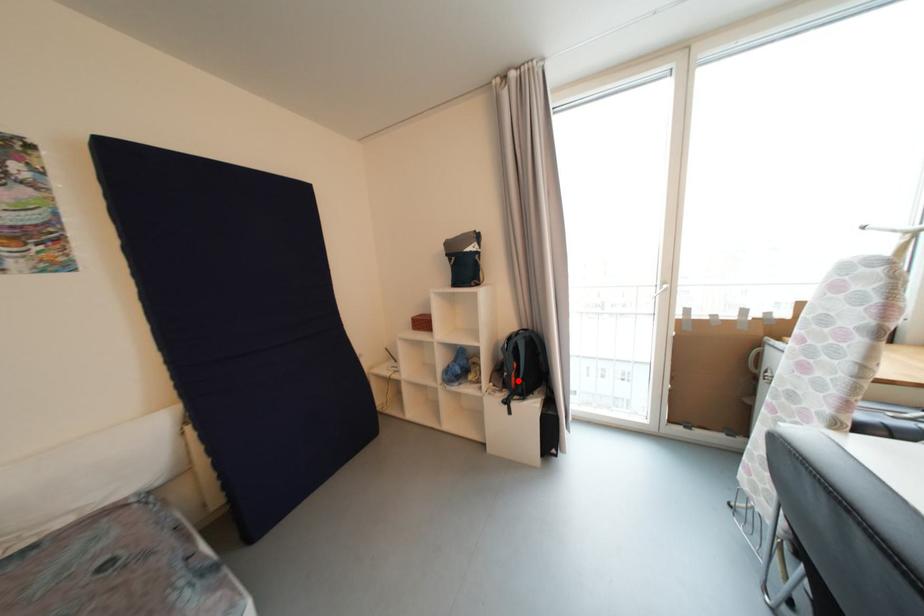
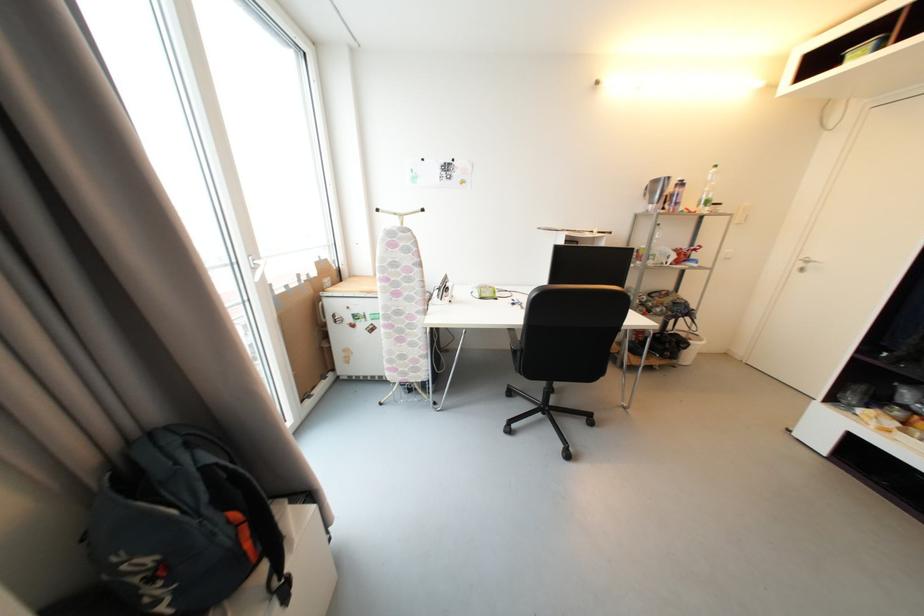
Find the pixel in the second image that matches the highlighted location in the first image.

(253, 546)